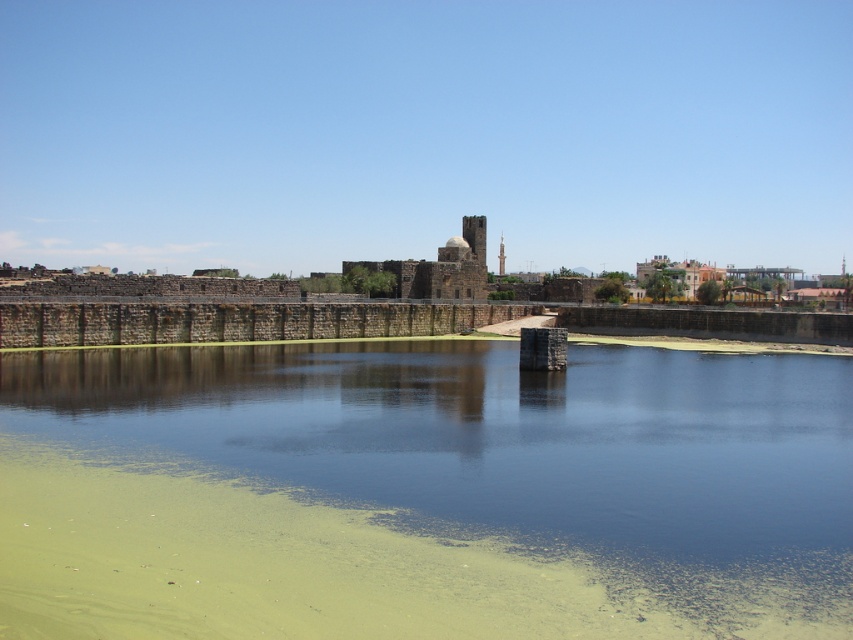
Question: Can you confirm if green algae-covered water at center is wider than dark brown stone fort at center?

Choices:
 (A) yes
 (B) no

Answer: (A)

Question: Is green algae-covered water at center closer to the viewer compared to dark brown stone fort at center?

Choices:
 (A) no
 (B) yes

Answer: (B)

Question: Does green algae-covered water at center appear under dark brown stone fort at center?

Choices:
 (A) no
 (B) yes

Answer: (B)

Question: Which object appears farthest from the camera in this image?

Choices:
 (A) green algae-covered water at center
 (B) dark brown stone fort at center

Answer: (B)